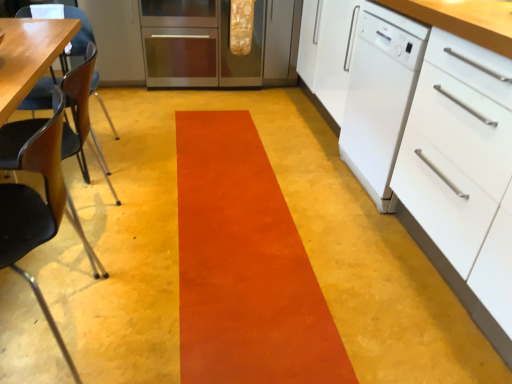
Question: Does wooden chair at left, the 2th chair from the front, have a lesser width compared to white matte drawer at right?

Choices:
 (A) no
 (B) yes

Answer: (B)

Question: From a real-world perspective, is wooden chair at left, the 2th chair from the front, located higher than white matte drawer at right?

Choices:
 (A) yes
 (B) no

Answer: (B)

Question: Considering the relative sizes of wooden chair at left, which is the 1th chair in back-to-front order, and white matte drawer at right in the image provided, is wooden chair at left, which is the 1th chair in back-to-front order, smaller than white matte drawer at right?

Choices:
 (A) no
 (B) yes

Answer: (B)

Question: From a real-world perspective, is wooden chair at left, the 2th chair from the front, below white matte drawer at right?

Choices:
 (A) no
 (B) yes

Answer: (B)

Question: Could you tell me if wooden chair at left, which is the 1th chair in back-to-front order, is turned towards white matte drawer at right?

Choices:
 (A) yes
 (B) no

Answer: (B)

Question: From the image's perspective, does wooden chair at left, which is the 1th chair in back-to-front order, appear lower than white matte drawer at right?

Choices:
 (A) yes
 (B) no

Answer: (B)

Question: Considering the relative positions of black plastic chair at left, the 2th chair positioned from the back, and orange suede rug at center in the image provided, is black plastic chair at left, the 2th chair positioned from the back, to the right of orange suede rug at center from the viewer's perspective?

Choices:
 (A) no
 (B) yes

Answer: (A)

Question: Does black plastic chair at left, the 2th chair positioned from the back, contain orange suede rug at center?

Choices:
 (A) yes
 (B) no

Answer: (B)

Question: Is black plastic chair at left, acting as the first chair starting from the front, thinner than orange suede rug at center?

Choices:
 (A) no
 (B) yes

Answer: (B)

Question: From a real-world perspective, is black plastic chair at left, acting as the first chair starting from the front, located higher than orange suede rug at center?

Choices:
 (A) yes
 (B) no

Answer: (A)

Question: From a real-world perspective, is black plastic chair at left, the 2th chair positioned from the back, beneath orange suede rug at center?

Choices:
 (A) yes
 (B) no

Answer: (B)

Question: Is black plastic chair at left, the 2th chair positioned from the back, outside orange suede rug at center?

Choices:
 (A) no
 (B) yes

Answer: (B)

Question: From a real-world perspective, does stainless steel oven at center sit lower than white glossy dishwasher at right?

Choices:
 (A) no
 (B) yes

Answer: (B)